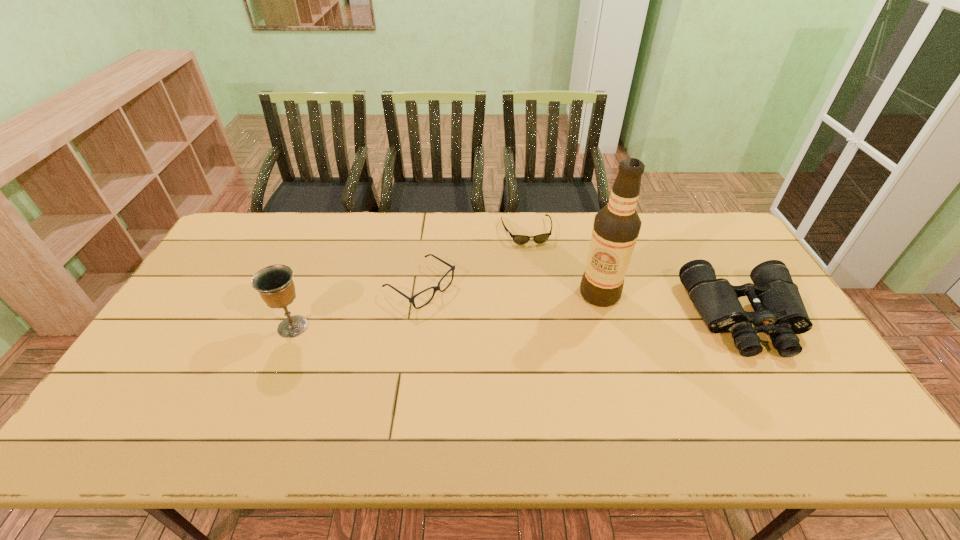
Where is `the fourth shortest object`? This screenshot has height=540, width=960. the fourth shortest object is located at coordinates (274, 283).

The height and width of the screenshot is (540, 960). I want to click on the leftmost object, so click(274, 283).

This screenshot has width=960, height=540. I want to click on binoculars, so pos(779,310).

Where is `the rightmost object`? The height and width of the screenshot is (540, 960). the rightmost object is located at coordinates (779, 310).

You are a GUI agent. You are given a task and a screenshot of the screen. Output one action in this format:
    pyautogui.click(x=<x>, y=<y>)
    Task: Click on the fourth object from left to right
    
    Given the screenshot: What is the action you would take?
    pyautogui.click(x=616, y=227)

The height and width of the screenshot is (540, 960). In order to click on alcohol in this screenshot , I will do (616, 227).

Image resolution: width=960 pixels, height=540 pixels. I want to click on the second shortest object, so click(x=435, y=288).

Find the location of `the fourth object from right to left`. the fourth object from right to left is located at coordinates (435, 288).

Where is `the shortest object`? The height and width of the screenshot is (540, 960). the shortest object is located at coordinates (541, 238).

I want to click on the farthest object, so (x=541, y=238).